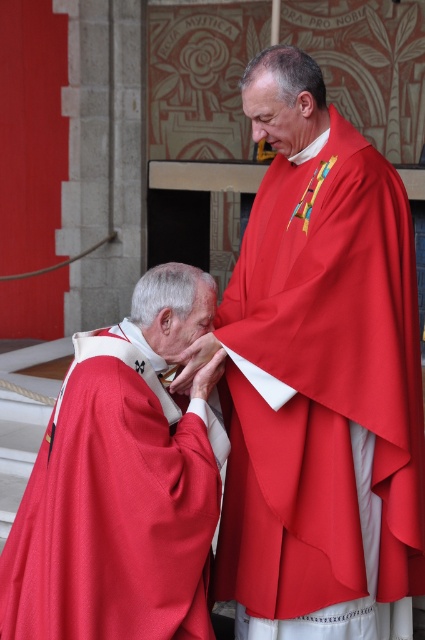
Can you confirm if matte red robe at center is positioned above matte red cape at left?

Indeed, matte red robe at center is positioned over matte red cape at left.

Who is lower down, matte red robe at center or matte red cape at left?

matte red cape at left is below.

Which is behind, point (277, 301) or point (93, 618)?

The point (277, 301) is more distant.

The image size is (425, 640). Identify the location of matte red robe at center. (323, 392).